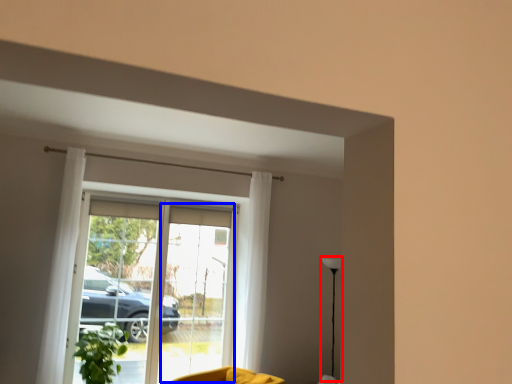
Question: Which object is closer to the camera taking this photo, lamp (highlighted by a red box) or screen door (highlighted by a blue box)?

Choices:
 (A) lamp
 (B) screen door

Answer: (A)